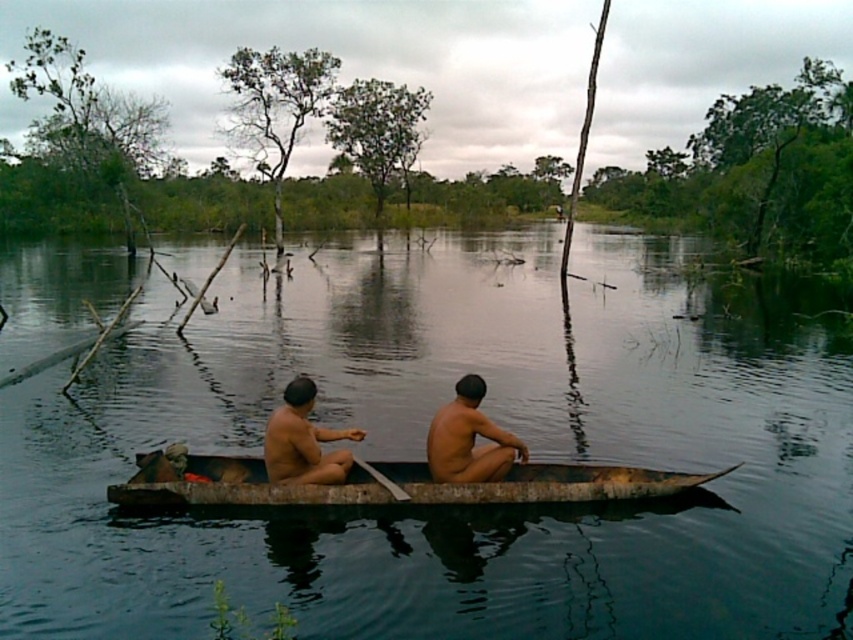
Between greenish-brown water at center and wooden canoe at center, which one appears on the left side from the viewer's perspective?

wooden canoe at center

Is point (518, 291) positioned in front of point (160, 476)?

No, (518, 291) is behind (160, 476).

You are a GUI agent. You are given a task and a screenshot of the screen. Output one action in this format:
    pyautogui.click(x=<x>, y=<y>)
    Task: Click on the greenish-brown water at center
    
    Given the screenshot: What is the action you would take?
    pyautogui.click(x=422, y=452)

Does brown skin man at center appear on the left side of wooden paddle at center?

Correct, you'll find brown skin man at center to the left of wooden paddle at center.

Which of these two, brown skin man at center or wooden paddle at center, stands shorter?

Standing shorter between the two is wooden paddle at center.

Is point (283, 422) positioned after point (375, 481)?

No.

This screenshot has height=640, width=853. I want to click on brown skin man at center, so click(303, 442).

Does naked skin at center come in front of wooden paddle at center?

Yes, naked skin at center is closer to the viewer.

Can you confirm if naked skin at center is thinner than wooden paddle at center?

No.

Identify the location of naked skin at center. This screenshot has height=640, width=853. (469, 440).

The image size is (853, 640). Find the location of `naked skin at center`. naked skin at center is located at coordinates (469, 440).